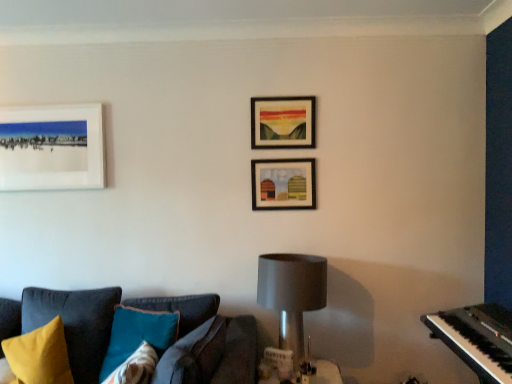
Question: Looking at their shapes, would you say teal velvet pillow at lower left, the 2th pillow from the left, is wider or thinner than wooden frame at upper center, positioned as the second picture frame in left-to-right order?

Choices:
 (A) thin
 (B) wide

Answer: (B)

Question: Would you say teal velvet pillow at lower left, the 2th pillow from the left, is to the left or to the right of wooden frame at upper center, positioned as the second picture frame in left-to-right order, in the picture?

Choices:
 (A) left
 (B) right

Answer: (A)

Question: Which object is positioned farthest from the white matte picture frame at upper left, the 1th picture frame in the left-to-right sequence?

Choices:
 (A) wooden frame at center, placed as the 3th picture frame when sorted from left to right
 (B) satin silver lampshade at center
 (C) wooden frame at upper center, positioned as the second picture frame in left-to-right order
 (D) yellow fabric pillow at lower left, marked as the 1th pillow in a left-to-right arrangement
 (E) black plastic piano at right

Answer: (E)

Question: Estimate the real-world distances between objects in this image. Which object is farther from the satin silver lampshade at center?

Choices:
 (A) black plastic piano at right
 (B) yellow fabric pillow at lower left, marked as the 1th pillow in a left-to-right arrangement
 (C) wooden frame at upper center, arranged as the second picture frame when viewed from the right
 (D) teal velvet pillow at lower left, arranged as the first pillow when viewed from the right
 (E) wooden frame at center, placed as the 3th picture frame when sorted from left to right

Answer: (B)